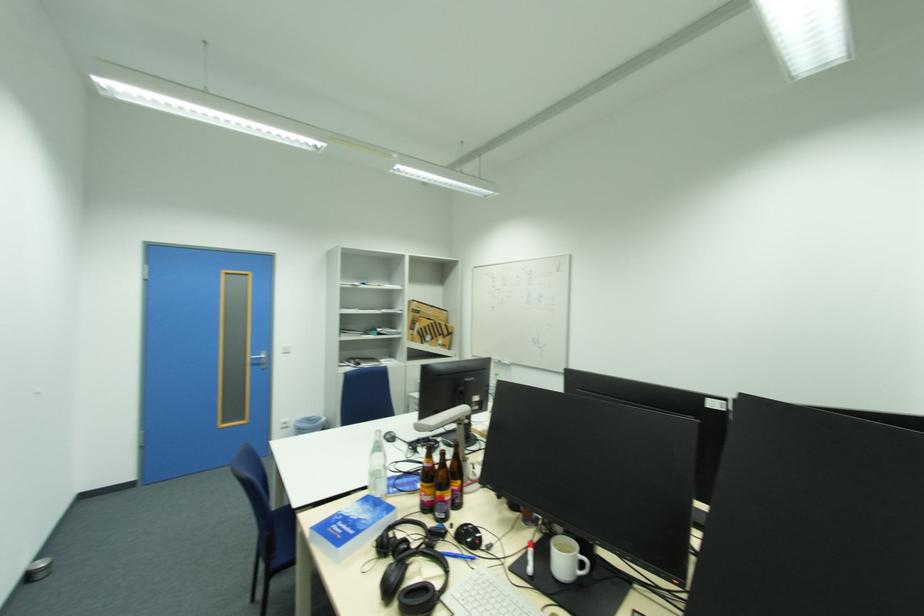
Which object does [487,597] point to?

It refers to a white computer keyboard.